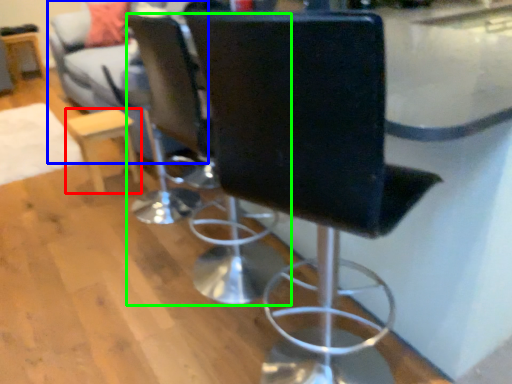
Question: Considering the real-world distances, which object is closest to furniture (highlighted by a red box)? couch (highlighted by a blue box) or chair (highlighted by a green box).

Choices:
 (A) couch
 (B) chair

Answer: (A)